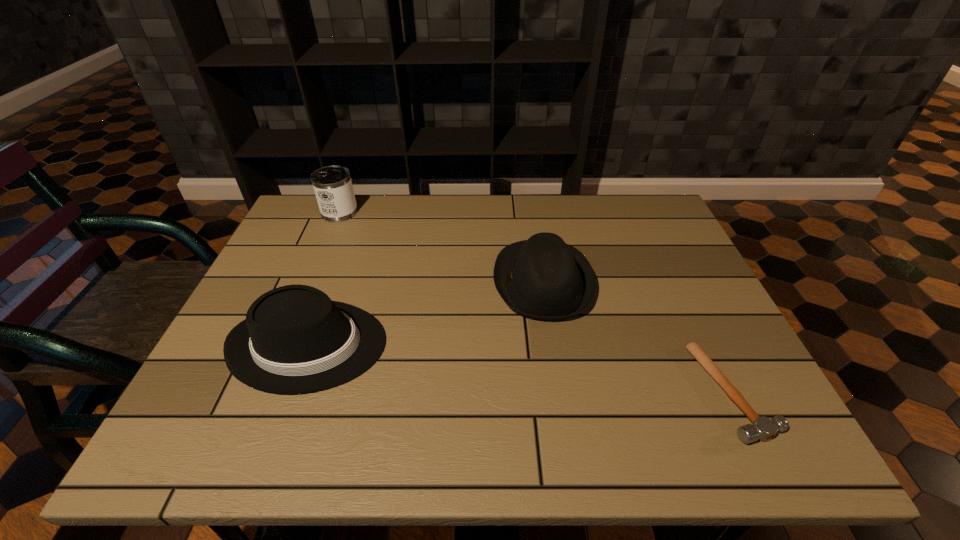
In order to click on vacant space located 0.200m on the left of the hammer in this screenshot , I will do `click(605, 392)`.

The image size is (960, 540). I want to click on object present at the far edge, so click(333, 187).

At what (x,y) coordinates should I click in order to perform the action: click on object located in the near edge section of the desktop. Please return your answer as a coordinate pair (x, y). This screenshot has width=960, height=540. Looking at the image, I should click on (762, 428).

This screenshot has height=540, width=960. Identify the location of can present at the left edge. (333, 187).

I want to click on fedora present at the left edge, so click(295, 339).

The width and height of the screenshot is (960, 540). I want to click on object that is positioned at the right edge, so click(x=762, y=428).

Find the location of a particular element. The width and height of the screenshot is (960, 540). object present at the far left corner is located at coordinates (333, 187).

You are a GUI agent. You are given a task and a screenshot of the screen. Output one action in this format:
    pyautogui.click(x=<x>, y=<y>)
    Task: Click on the object that is at the near right corner
    The image size is (960, 540).
    Given the screenshot: What is the action you would take?
    pyautogui.click(x=762, y=428)

The image size is (960, 540). Identify the location of vacant space at the far edge of the desktop. (541, 194).

The height and width of the screenshot is (540, 960). What are the coordinates of `free region at the near edge of the desktop` in the screenshot? It's located at tap(466, 421).